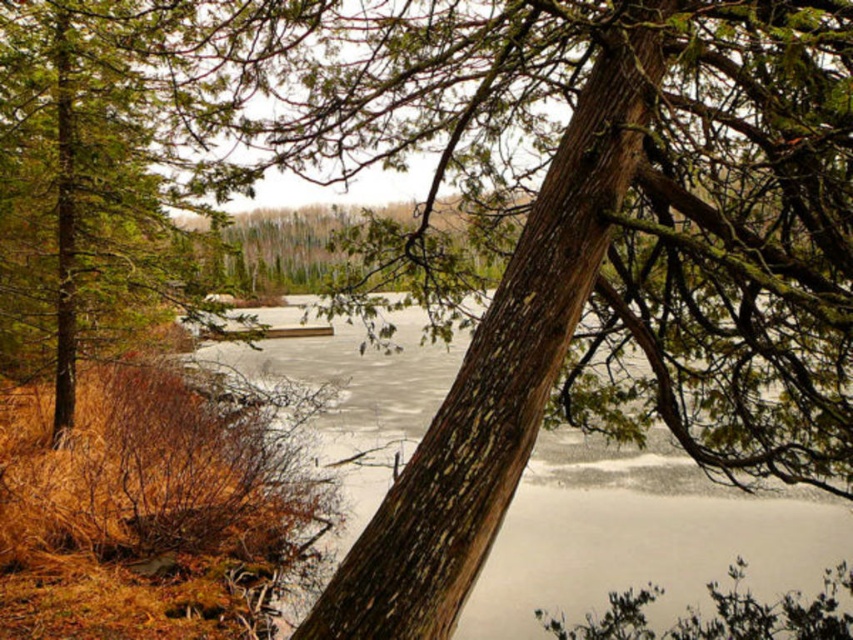
Question: Which object appears farthest from the camera in this image?

Choices:
 (A) frozen ice at center
 (B) green rough bark tree at left

Answer: (B)

Question: Can you confirm if frozen ice at center is positioned below green rough bark tree at left?

Choices:
 (A) yes
 (B) no

Answer: (A)

Question: Is frozen ice at center below green rough bark tree at left?

Choices:
 (A) no
 (B) yes

Answer: (B)

Question: Which of the following is the farthest from the observer?

Choices:
 (A) (300, 310)
 (B) (187, 44)

Answer: (A)

Question: Is frozen ice at center positioned behind green rough bark tree at left?

Choices:
 (A) yes
 (B) no

Answer: (B)